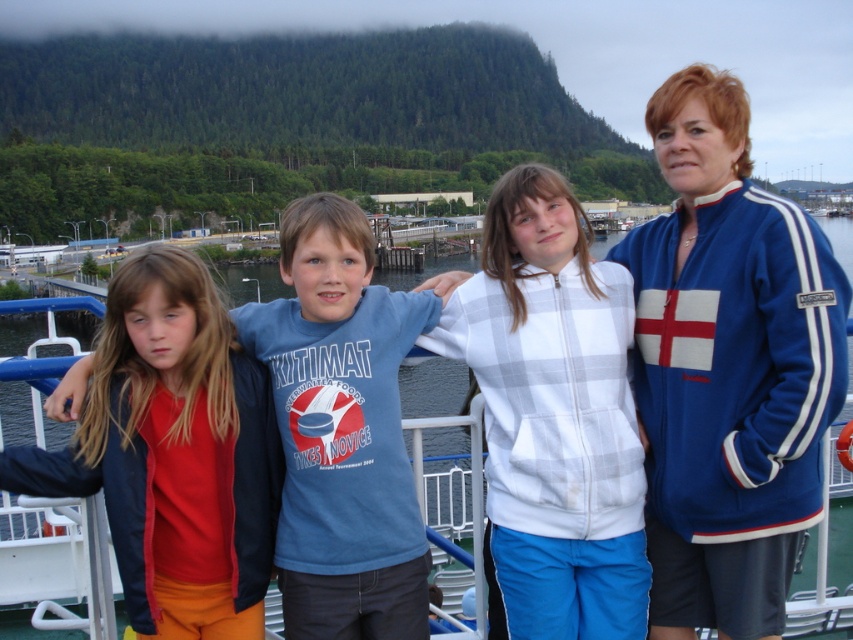
Is blue cotton t-shirt at center positioned at the back of blue fabric boat at center?

Yes, blue cotton t-shirt at center is behind blue fabric boat at center.

I want to click on blue cotton t-shirt at center, so click(343, 428).

Between blue fleece jacket at right and blue cotton t-shirt at center, which one appears on the right side from the viewer's perspective?

blue fleece jacket at right is more to the right.

Find the location of `blue fleece jacket at right`. blue fleece jacket at right is located at coordinates (728, 369).

Where is `blue fleece jacket at right`? blue fleece jacket at right is located at coordinates (728, 369).

Is point (670, 216) closer to camera compared to point (231, 513)?

No, it is behind (231, 513).

Is blue fleece jacket at right further to camera compared to matte red shirt at left?

No, it is not.

Who is more forward, (717,337) or (202,557)?

Point (202,557) is in front.

The height and width of the screenshot is (640, 853). In order to click on blue fleece jacket at right in this screenshot , I will do `click(728, 369)`.